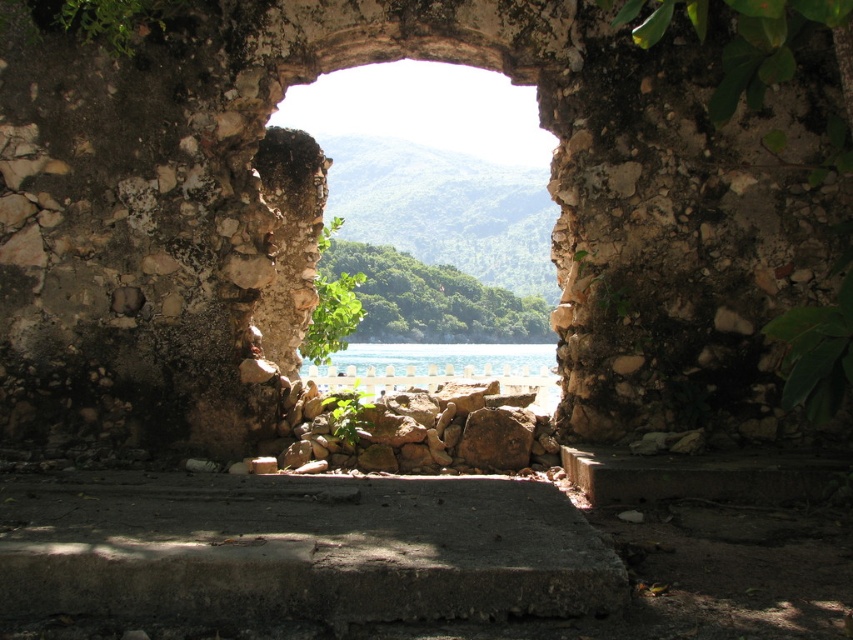
You are standing in front of a rustic stone archway that frames a serene natural landscape. You notice a point marked at coordinates (436, 164). Based on the scene description, where is this point located?

The point at (436, 164) is located on the natural stone window at center, as described in the scene.

You are standing in front of the rustic stone archway and want to see the clear blue water at center beyond the natural stone window at center. Can you see the water through the archway?

Yes, because the natural stone window at center is in front of the clear blue water at center, so the water is visible through the archway.

You are standing in front of the rustic stone archway. Where is the natural stone window at center located in the scene?

The natural stone window at center is located at point coordinates of (436, 164).